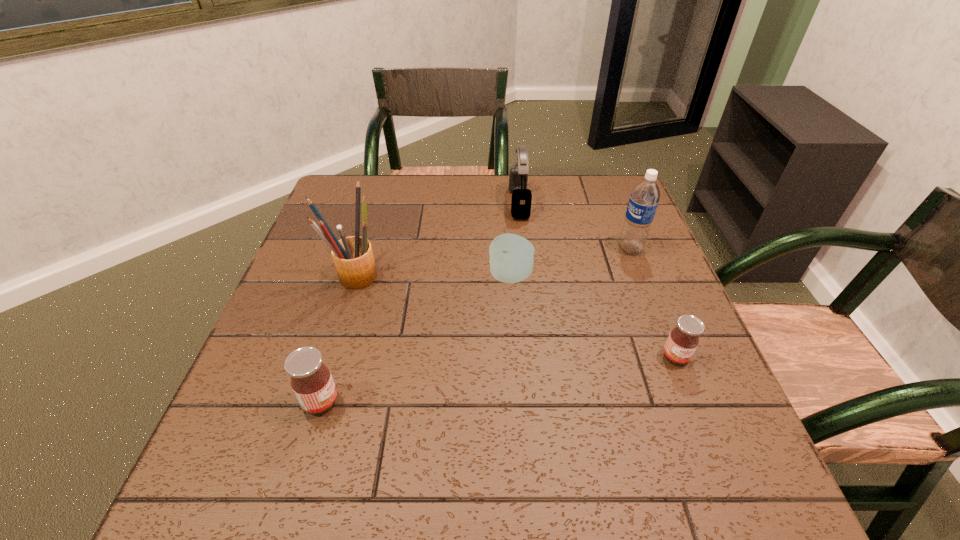
If equal spacing is the goal by inserting an additional jam among them, please point out a vacant space for this new jam. Please provide its 2D coordinates. Your answer should be formatted as a tuple, i.e. [(x, y)], where the tuple contains the x and y coordinates of a point satisfying the conditions above.

[(506, 378)]